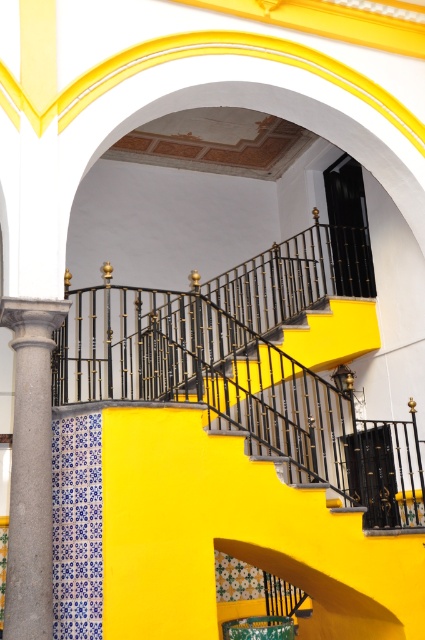
Question: Which point is closer to the camera?

Choices:
 (A) gray stone column at left
 (B) black wrought iron balustrade at center

Answer: (A)

Question: Is gray stone column at left wider than black wrought iron balustrade at center?

Choices:
 (A) yes
 (B) no

Answer: (B)

Question: Among these points, which one is nearest to the camera?

Choices:
 (A) (328, 264)
 (B) (19, 588)

Answer: (B)

Question: Which of the following is the farthest from the observer?

Choices:
 (A) (76, 390)
 (B) (22, 356)

Answer: (A)

Question: Is gray stone column at left positioned before black wrought iron balustrade at center?

Choices:
 (A) no
 (B) yes

Answer: (B)

Question: Is gray stone column at left bigger than black wrought iron balustrade at center?

Choices:
 (A) yes
 (B) no

Answer: (B)